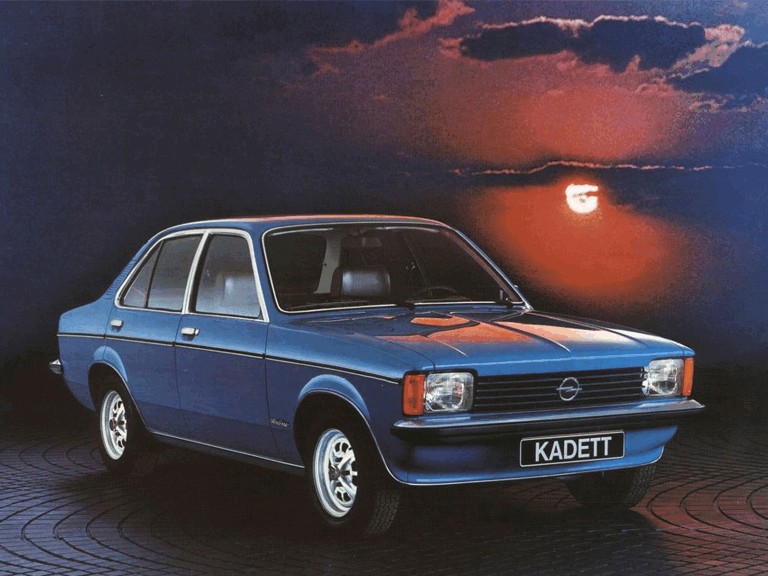
Locate an element on the screen. The height and width of the screenshot is (576, 768). door handles is located at coordinates (116, 321), (186, 331).